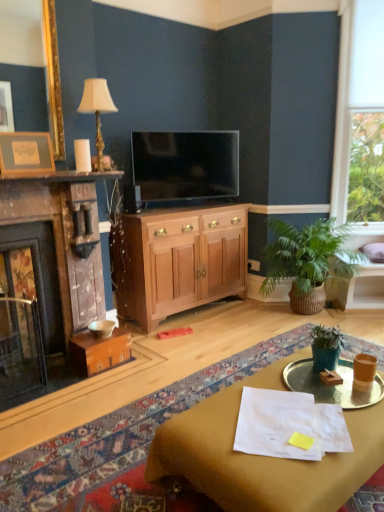
Question: Should I look upward or downward to see green matte plant pot at center, which is the first houseplant in front-to-back order?

Choices:
 (A) down
 (B) up

Answer: (A)

Question: Are matte wood mantle at upper center and translucent glass tray at center beside each other?

Choices:
 (A) no
 (B) yes

Answer: (A)

Question: Could translucent glass tray at center be considered to be inside matte wood mantle at upper center?

Choices:
 (A) yes
 (B) no

Answer: (B)

Question: Is matte wood mantle at upper center oriented towards translucent glass tray at center?

Choices:
 (A) yes
 (B) no

Answer: (B)

Question: Does matte wood mantle at upper center appear on the left side of translucent glass tray at center?

Choices:
 (A) yes
 (B) no

Answer: (A)

Question: Is matte wood mantle at upper center looking in the opposite direction of translucent glass tray at center?

Choices:
 (A) no
 (B) yes

Answer: (A)

Question: Does matte wood mantle at upper center have a lesser width compared to translucent glass tray at center?

Choices:
 (A) no
 (B) yes

Answer: (B)

Question: Is green matte plant pot at center, which is the first houseplant in front-to-back order, thinner than wooden cabinet at center?

Choices:
 (A) no
 (B) yes

Answer: (B)

Question: Is green matte plant pot at center, which is the first houseplant in front-to-back order, positioned in front of wooden cabinet at center?

Choices:
 (A) yes
 (B) no

Answer: (A)

Question: Considering the relative positions of green matte plant pot at center, which is counted as the 2th houseplant, starting from the back, and wooden cabinet at center in the image provided, is green matte plant pot at center, which is counted as the 2th houseplant, starting from the back, to the left of wooden cabinet at center from the viewer's perspective?

Choices:
 (A) no
 (B) yes

Answer: (A)

Question: Can you confirm if green matte plant pot at center, which is the first houseplant in front-to-back order, is wider than wooden cabinet at center?

Choices:
 (A) no
 (B) yes

Answer: (A)

Question: From a real-world perspective, is green matte plant pot at center, which is counted as the 2th houseplant, starting from the back, on wooden cabinet at center?

Choices:
 (A) yes
 (B) no

Answer: (B)

Question: Could wooden cabinet at center be considered to be inside green matte plant pot at center, which is the first houseplant in front-to-back order?

Choices:
 (A) no
 (B) yes

Answer: (A)

Question: Considering the relative positions of matte black tv at center and green woven basket at right, which is the second houseplant in front-to-back order, in the image provided, is matte black tv at center to the right of green woven basket at right, which is the second houseplant in front-to-back order, from the viewer's perspective?

Choices:
 (A) yes
 (B) no

Answer: (B)